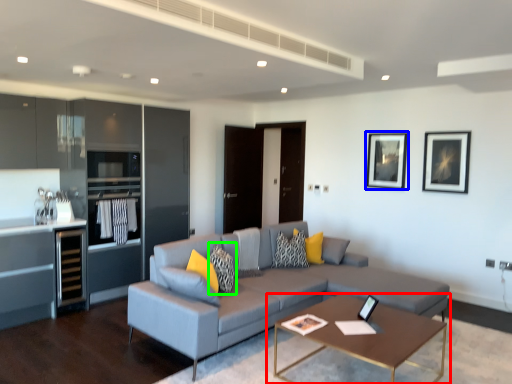
Question: Based on their relative distances, which object is farther from coffee table (highlighted by a red box)? Choose from picture frame (highlighted by a blue box) and pillow (highlighted by a green box).

Choices:
 (A) picture frame
 (B) pillow

Answer: (A)